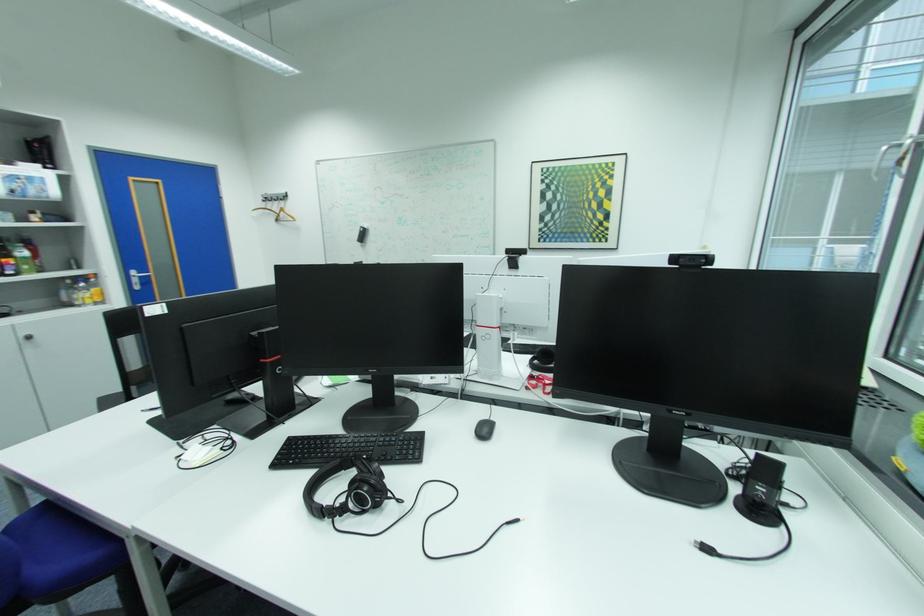
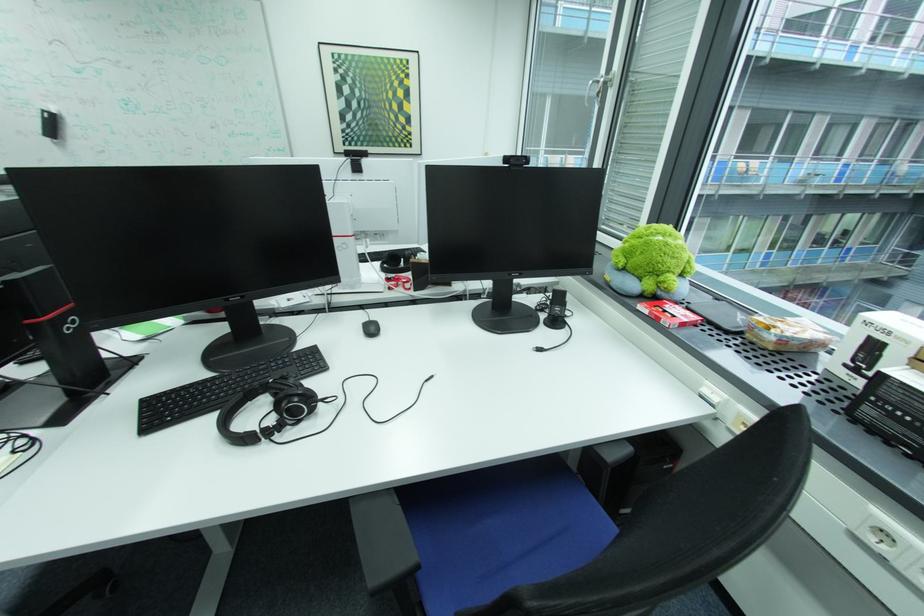
Where in the second image is the point corresponding to [380,471] from the first image?

(299, 387)